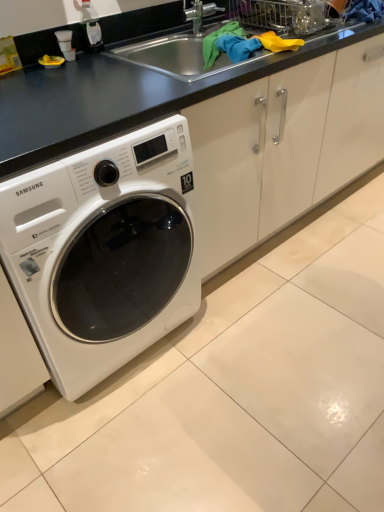
Question: Would you say white glossy washing machine at lower left is part of black matte counter top at upper center's contents?

Choices:
 (A) yes
 (B) no

Answer: (B)

Question: Does black matte counter top at upper center have a lesser height compared to white glossy washing machine at lower left?

Choices:
 (A) no
 (B) yes

Answer: (B)

Question: Does black matte counter top at upper center have a larger size compared to white glossy washing machine at lower left?

Choices:
 (A) no
 (B) yes

Answer: (A)

Question: Does black matte counter top at upper center come in front of white glossy washing machine at lower left?

Choices:
 (A) yes
 (B) no

Answer: (B)

Question: Does black matte counter top at upper center appear on the left side of white glossy washing machine at lower left?

Choices:
 (A) no
 (B) yes

Answer: (A)

Question: Can you confirm if black matte counter top at upper center is thinner than white glossy washing machine at lower left?

Choices:
 (A) no
 (B) yes

Answer: (B)

Question: Is clear plastic bottle at upper left oriented towards white glossy washing machine at lower left?

Choices:
 (A) no
 (B) yes

Answer: (A)

Question: Is clear plastic bottle at upper left bigger than white glossy washing machine at lower left?

Choices:
 (A) no
 (B) yes

Answer: (A)

Question: From the image's perspective, would you say clear plastic bottle at upper left is shown under white glossy washing machine at lower left?

Choices:
 (A) no
 (B) yes

Answer: (A)

Question: Considering the relative sizes of clear plastic bottle at upper left and white glossy washing machine at lower left in the image provided, is clear plastic bottle at upper left shorter than white glossy washing machine at lower left?

Choices:
 (A) no
 (B) yes

Answer: (B)

Question: Is the position of clear plastic bottle at upper left more distant than that of white glossy washing machine at lower left?

Choices:
 (A) yes
 (B) no

Answer: (A)

Question: Can you confirm if clear plastic bottle at upper left is positioned to the right of white glossy washing machine at lower left?

Choices:
 (A) no
 (B) yes

Answer: (B)

Question: From the image's perspective, is white glossy washing machine at lower left under clear plastic bottle at upper left?

Choices:
 (A) no
 (B) yes

Answer: (B)